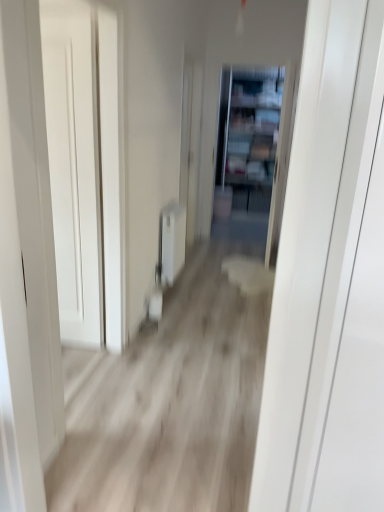
Question: From a real-world perspective, relative to wooden floor at center, is white smooth door at left vertically above or below?

Choices:
 (A) below
 (B) above

Answer: (B)

Question: Is white smooth door at left wider or thinner than wooden floor at center?

Choices:
 (A) thin
 (B) wide

Answer: (A)

Question: Estimate the real-world distances between objects in this image. Which object is farther from the white smooth door at left?

Choices:
 (A) wooden floor at center
 (B) clear glass bookshelf at center

Answer: (B)

Question: Estimate the real-world distances between objects in this image. Which object is closer to the white smooth door at left?

Choices:
 (A) wooden floor at center
 (B) clear glass bookshelf at center

Answer: (A)